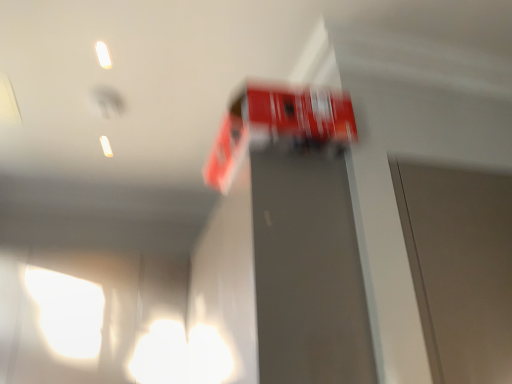
Question: Considering the positions of red glossy fire truck at upper center and metallic gray elevator door at center in the image, is red glossy fire truck at upper center wider or thinner than metallic gray elevator door at center?

Choices:
 (A) wide
 (B) thin

Answer: (A)

Question: Choose the correct answer: Is red glossy fire truck at upper center inside metallic gray elevator door at center or outside it?

Choices:
 (A) inside
 (B) outside

Answer: (B)

Question: From a real-world perspective, relative to metallic gray elevator door at center, is red glossy fire truck at upper center vertically above or below?

Choices:
 (A) below
 (B) above

Answer: (B)

Question: Does point (368, 331) appear closer or farther from the camera than point (300, 117)?

Choices:
 (A) closer
 (B) farther

Answer: (A)

Question: Is metallic gray elevator door at center inside the boundaries of red glossy fire truck at upper center, or outside?

Choices:
 (A) outside
 (B) inside

Answer: (A)

Question: In the image, is metallic gray elevator door at center on the left side or the right side of red glossy fire truck at upper center?

Choices:
 (A) right
 (B) left

Answer: (B)

Question: In the image, is metallic gray elevator door at center positioned in front of or behind red glossy fire truck at upper center?

Choices:
 (A) behind
 (B) front

Answer: (B)